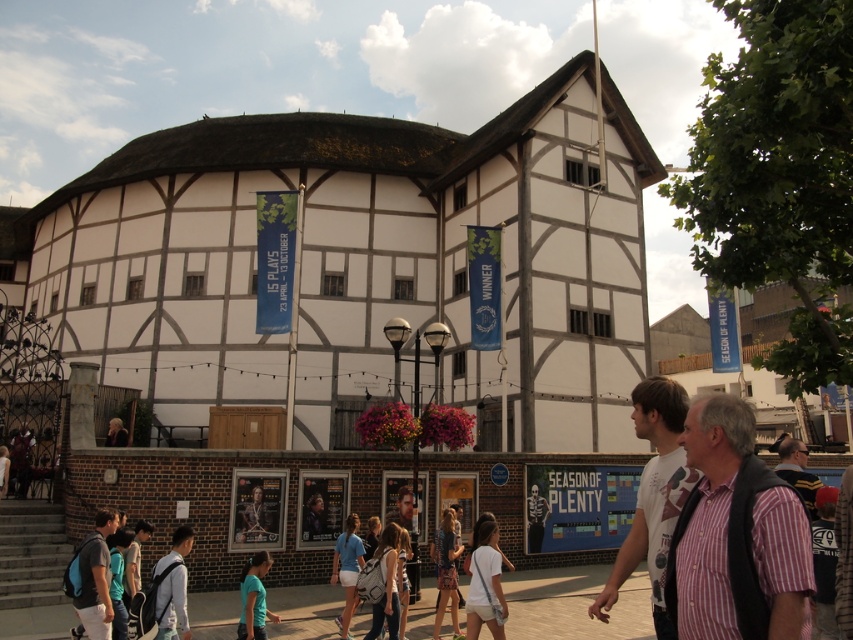
You are standing in front of the historic building and want to take a photo. You notice two points marked as point 1 at coordinates point (80, 544) and point 2 at coordinates point (115, 419). Which point will appear larger in your photo?

Point 1 at coordinates point (80, 544) will appear larger in the photo because it is closer to the camera than point 2 at coordinates point (115, 419).

You are standing in front of the historic building and notice a white fabric backpack at lower left and a blonde hair at lower left. Which object is positioned more to the left?

The blonde hair at lower left is positioned more to the left since the white fabric backpack at lower left is located to its right.

From the picture: You are standing in front of the historic building and notice a point marked at coordinates (x=173, y=588). Based on the scene description, can you identify what object this point is located on?

The point at coordinates (x=173, y=588) is located on the white fabric backpack at lower left.